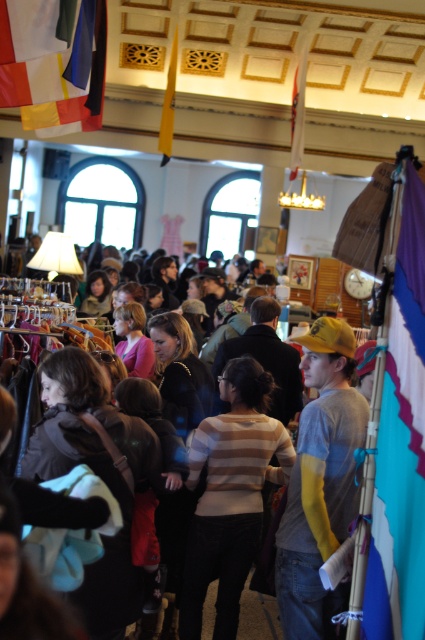
Question: Does blue fabric flag at right have a smaller size compared to yellow fabric cap at center?

Choices:
 (A) yes
 (B) no

Answer: (A)

Question: Estimate the real-world distances between objects in this image. Which object is farther from the yellow fabric flag at upper center?

Choices:
 (A) yellow fabric cap at center
 (B) white fabric flag at upper center

Answer: (A)

Question: Estimate the real-world distances between objects in this image. Which object is farther from the white fabric flag at upper center?

Choices:
 (A) yellow fabric cap at center
 (B) yellow fabric flag at upper center
 (C) white fabric flag at upper left
 (D) striped sweater at center

Answer: (A)

Question: Can you confirm if white fabric flag at upper left is positioned to the right of yellow fabric flag at upper center?

Choices:
 (A) no
 (B) yes

Answer: (A)

Question: Among these points, which one is nearest to the camera?

Choices:
 (A) (317, 611)
 (B) (65, 19)

Answer: (A)

Question: Can you confirm if striped sweater at center is wider than yellow fabric flag at upper center?

Choices:
 (A) yes
 (B) no

Answer: (A)